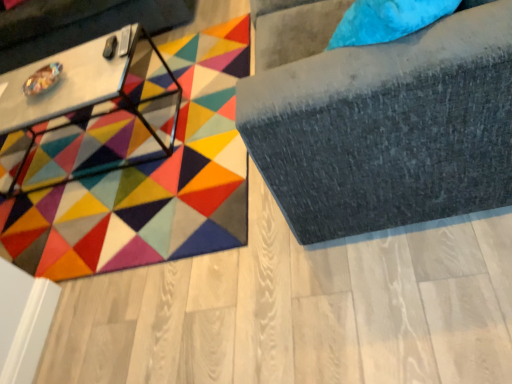
Question: Is white glossy table at upper left outside metallic silver swivel chair at left?

Choices:
 (A) no
 (B) yes

Answer: (B)

Question: From the image's perspective, is white glossy table at upper left located beneath metallic silver swivel chair at left?

Choices:
 (A) yes
 (B) no

Answer: (A)

Question: Is white glossy table at upper left positioned with its back to metallic silver swivel chair at left?

Choices:
 (A) yes
 (B) no

Answer: (B)

Question: Are white glossy table at upper left and metallic silver swivel chair at left located far from each other?

Choices:
 (A) no
 (B) yes

Answer: (A)

Question: Can you confirm if white glossy table at upper left is smaller than metallic silver swivel chair at left?

Choices:
 (A) yes
 (B) no

Answer: (A)

Question: Based on their positions, is metallic silver swivel chair at left located to the left or right of suede gray sofa at upper right?

Choices:
 (A) left
 (B) right

Answer: (A)

Question: Considering their positions, is metallic silver swivel chair at left located in front of or behind suede gray sofa at upper right?

Choices:
 (A) behind
 (B) front

Answer: (A)

Question: From a real-world perspective, is metallic silver swivel chair at left above or below suede gray sofa at upper right?

Choices:
 (A) below
 (B) above

Answer: (A)

Question: Is metallic silver swivel chair at left spatially inside suede gray sofa at upper right, or outside of it?

Choices:
 (A) outside
 (B) inside

Answer: (A)

Question: From the image's perspective, is white glossy table at upper left above or below metallic silver swivel chair at left?

Choices:
 (A) below
 (B) above

Answer: (A)

Question: Is white glossy table at upper left in front of or behind metallic silver swivel chair at left in the image?

Choices:
 (A) behind
 (B) front

Answer: (B)

Question: Considering the positions of point (30, 66) and point (73, 14), is point (30, 66) closer or farther from the camera than point (73, 14)?

Choices:
 (A) farther
 (B) closer

Answer: (B)

Question: From a real-world perspective, is white glossy table at upper left positioned above or below metallic silver swivel chair at left?

Choices:
 (A) below
 (B) above

Answer: (A)

Question: Looking at the image, does suede gray sofa at upper right seem bigger or smaller compared to metallic silver swivel chair at left?

Choices:
 (A) small
 (B) big

Answer: (A)

Question: Visually, is suede gray sofa at upper right positioned to the left or to the right of metallic silver swivel chair at left?

Choices:
 (A) right
 (B) left

Answer: (A)